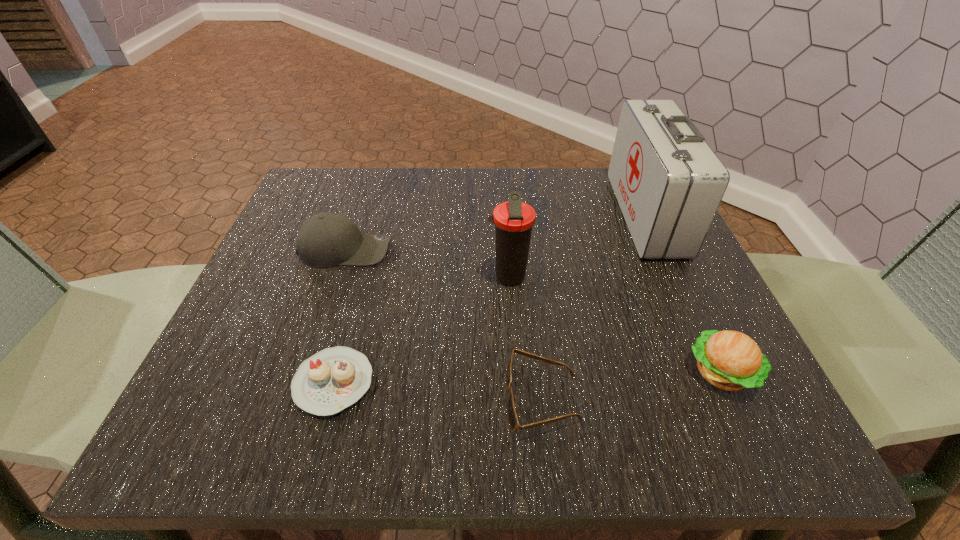
In order to click on vacant space located 0.060m on the front brim of the baseball cap in this screenshot , I will do `click(420, 250)`.

Identify the location of free space located 0.130m on the left of the hamburger. (602, 373).

Identify the location of vacant space positioned 0.050m on the left of the cupcake. Image resolution: width=960 pixels, height=540 pixels. (261, 382).

Find the location of a particular element. This screenshot has width=960, height=540. vacant space positioned on the frames of the sunglasses is located at coordinates (307, 400).

Find the location of a particular element. free spot located on the frames of the sunglasses is located at coordinates (411, 400).

Where is `free point located 0.130m on the frames of the sunglasses`? Image resolution: width=960 pixels, height=540 pixels. free point located 0.130m on the frames of the sunglasses is located at coordinates (418, 400).

You are a GUI agent. You are given a task and a screenshot of the screen. Output one action in this format:
    pyautogui.click(x=<x>, y=<y>)
    Task: Click on the object located in the far edge section of the desktop
    
    Given the screenshot: What is the action you would take?
    pyautogui.click(x=668, y=182)

The height and width of the screenshot is (540, 960). I want to click on hamburger positioned at the near edge, so click(730, 360).

You are a GUI agent. You are given a task and a screenshot of the screen. Output one action in this format:
    pyautogui.click(x=<x>, y=<y>)
    Task: Click on the cupcake at the near edge
    Image resolution: width=960 pixels, height=540 pixels.
    Given the screenshot: What is the action you would take?
    pyautogui.click(x=333, y=379)

Where is `sunglasses located at the near edge`? The width and height of the screenshot is (960, 540). sunglasses located at the near edge is located at coordinates (511, 413).